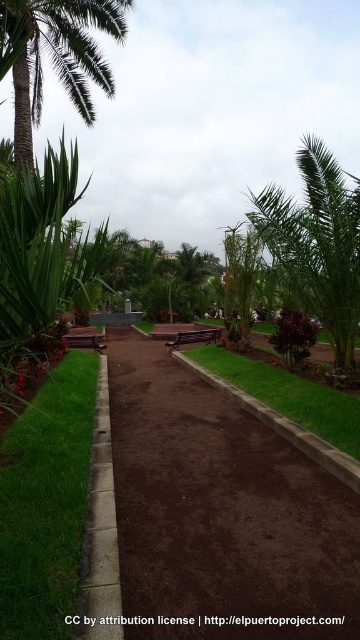
Question: Can you confirm if green grass at lower left is wider than green turf at center?

Choices:
 (A) no
 (B) yes

Answer: (A)

Question: Which of these objects is positioned closest to the green grass at lower left?

Choices:
 (A) green turf at center
 (B) green leafy palm tree at upper right

Answer: (A)

Question: Which object is the farthest from the green turf at center?

Choices:
 (A) green leafy palm tree at upper right
 (B) brown dirt path at center

Answer: (A)

Question: Is green grass at lower left above green turf at center?

Choices:
 (A) no
 (B) yes

Answer: (A)

Question: Does green grass at lower left appear over green leafy palm tree at upper right?

Choices:
 (A) yes
 (B) no

Answer: (B)

Question: Which is farther from the green grass at lower left?

Choices:
 (A) green leafy palm tree at upper right
 (B) green turf at center

Answer: (A)